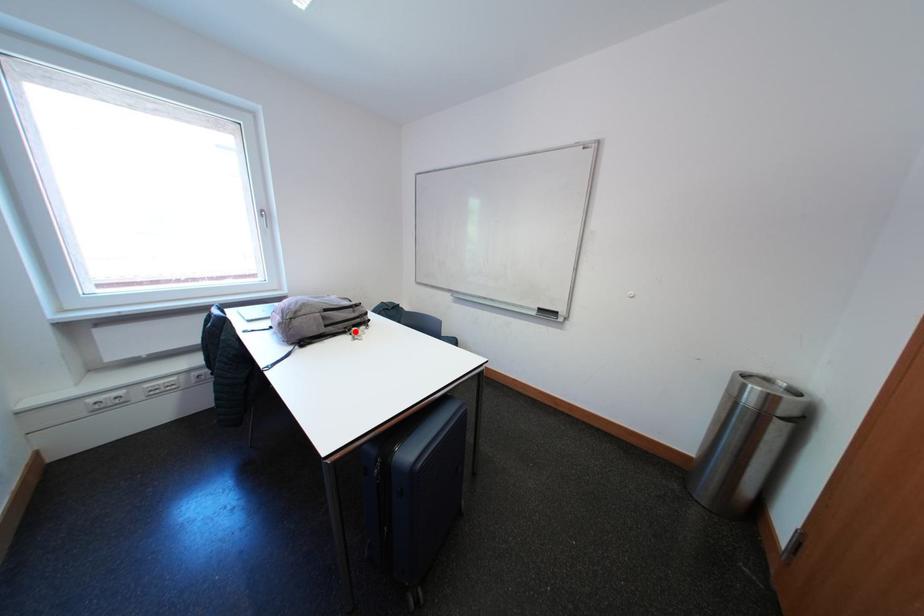
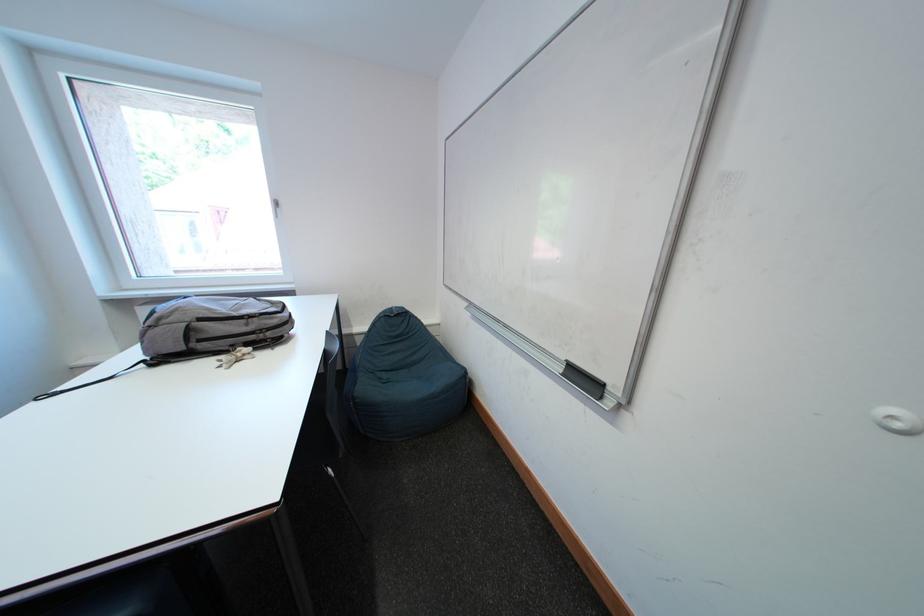
Where in the second image is the point corresponding to the highlighted location from the first image?

(241, 349)